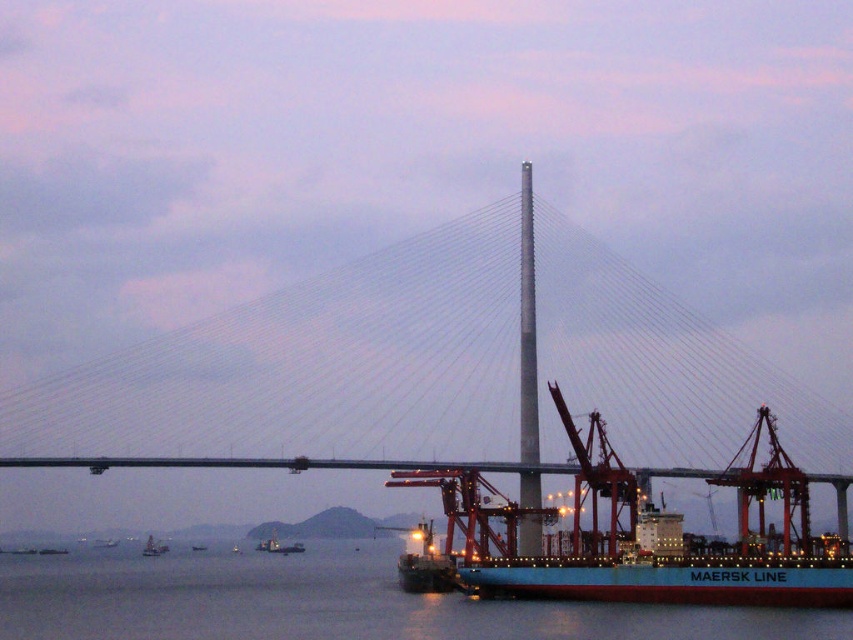
Question: Which object appears farthest from the camera in this image?

Choices:
 (A) teal matte container ship at center
 (B) metallic gray boat at lower left
 (C) metallic blue container ship at lower center
 (D) metallic blue ship at center

Answer: (C)

Question: Can you confirm if blue water at lower center is thinner than metallic gray boat at lower left?

Choices:
 (A) yes
 (B) no

Answer: (B)

Question: Is smooth gray bridge at center positioned at the back of metallic blue ship at center?

Choices:
 (A) no
 (B) yes

Answer: (A)

Question: Does teal matte container ship at center appear on the right side of metallic blue ship at center?

Choices:
 (A) no
 (B) yes

Answer: (B)

Question: Which point is farther to the camera?

Choices:
 (A) (194, 609)
 (B) (113, 541)
 (C) (410, 333)
 (D) (149, 540)

Answer: (B)

Question: Which object appears closest to the camera in this image?

Choices:
 (A) metallic blue container ship at lower center
 (B) teal matte container ship at center
 (C) metallic gray boat at lower left
 (D) metallic blue ship at center

Answer: (B)